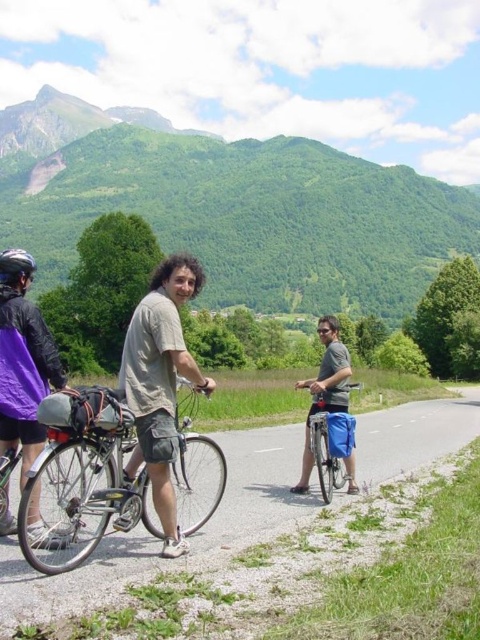
Between purple matte jacket at left and black matte bicycle helmet at left, which one appears on the left side from the viewer's perspective?

black matte bicycle helmet at left is more to the left.

Who is lower down, purple matte jacket at left or black matte bicycle helmet at left?

purple matte jacket at left

You are a GUI agent. You are given a task and a screenshot of the screen. Output one action in this format:
    pyautogui.click(x=<x>, y=<y>)
    Task: Click on the purple matte jacket at left
    The width and height of the screenshot is (480, 640).
    Given the screenshot: What is the action you would take?
    pyautogui.click(x=23, y=360)

The image size is (480, 640). What are the coordinates of `purple matte jacket at left` in the screenshot? It's located at (23, 360).

Locate an element on the screen. green grassy mountain at upper center is located at coordinates (232, 209).

Which is in front, point (428, 182) or point (20, 424)?

Positioned in front is point (20, 424).

Image resolution: width=480 pixels, height=640 pixels. Describe the element at coordinates (232, 209) in the screenshot. I see `green grassy mountain at upper center` at that location.

Where is `green grassy mountain at upper center`? green grassy mountain at upper center is located at coordinates (232, 209).

The image size is (480, 640). I want to click on green grassy mountain at upper center, so click(x=232, y=209).

Which is in front, point (127, 200) or point (118, 522)?

Point (118, 522) is in front.

At what (x,y) coordinates should I click in order to perform the action: click on green grassy mountain at upper center. Please return your answer as a coordinate pair (x, y). Looking at the image, I should click on (232, 209).